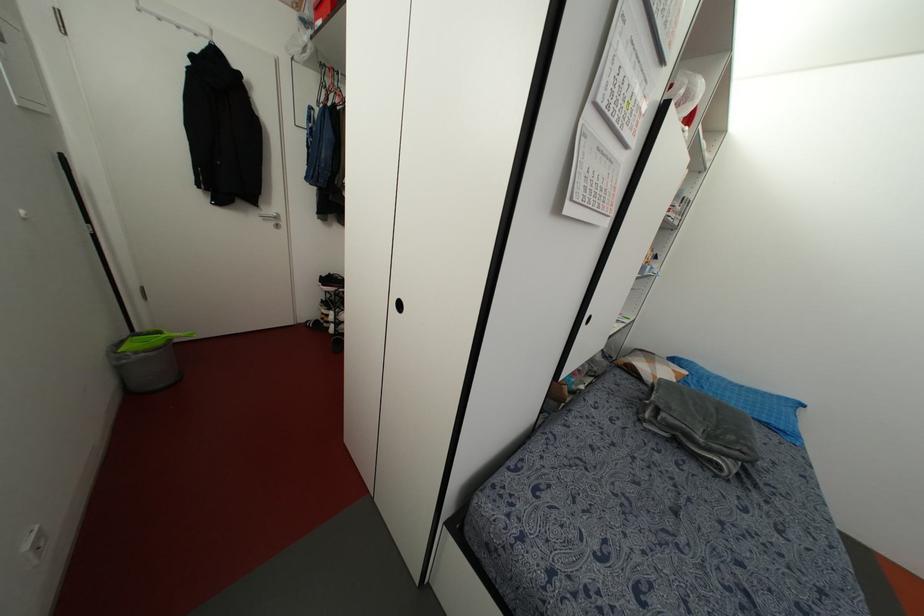
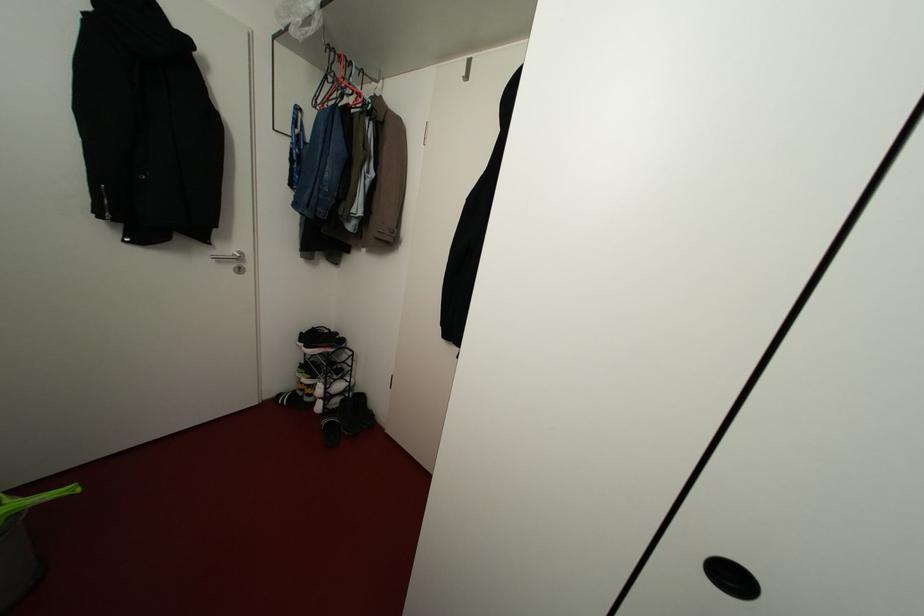
Question: The camera is either moving clockwise (left) or counter-clockwise (right) around the object. The first image is from the beginning of the video and the second image is from the end. Is the camera moving left or right when shooting the video?

Choices:
 (A) Left
 (B) Right

Answer: (A)